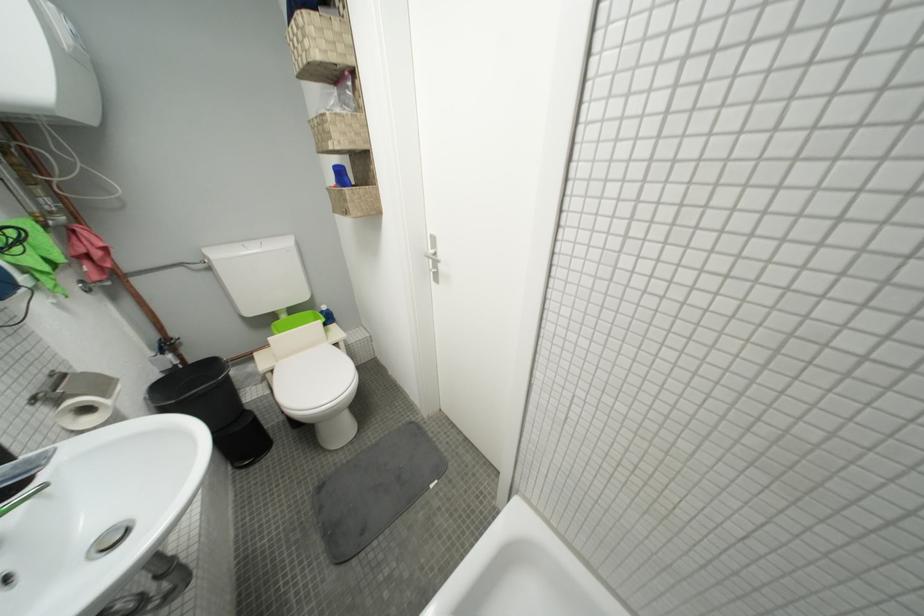
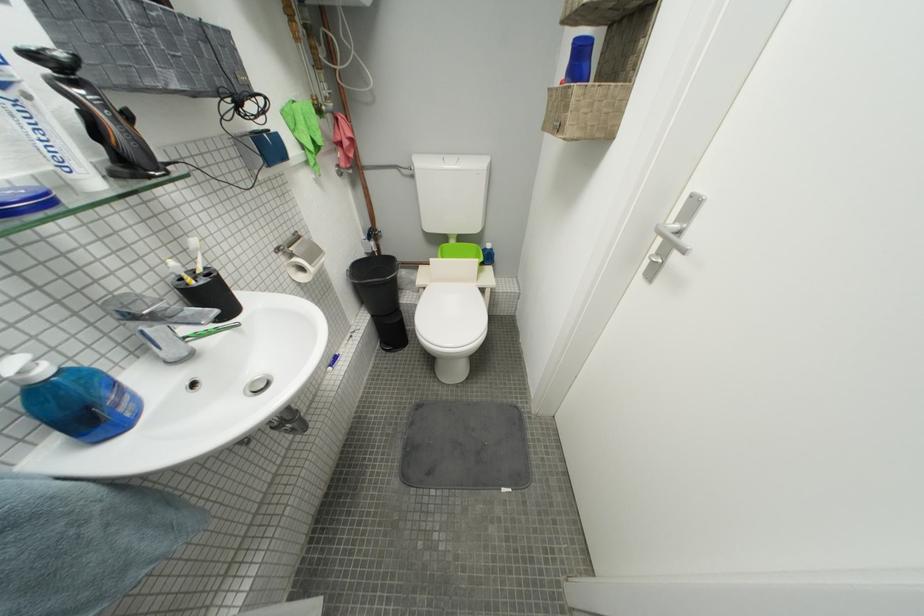
Find the pixel in the second image that matches (x=113, y=397) in the first image.

(320, 265)